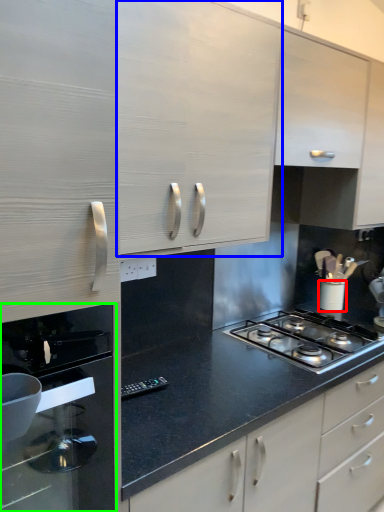
Question: Which is nearer to the kitchen appliance (highlighted by a red box)? cabinetry (highlighted by a blue box) or home appliance (highlighted by a green box).

Choices:
 (A) cabinetry
 (B) home appliance

Answer: (A)